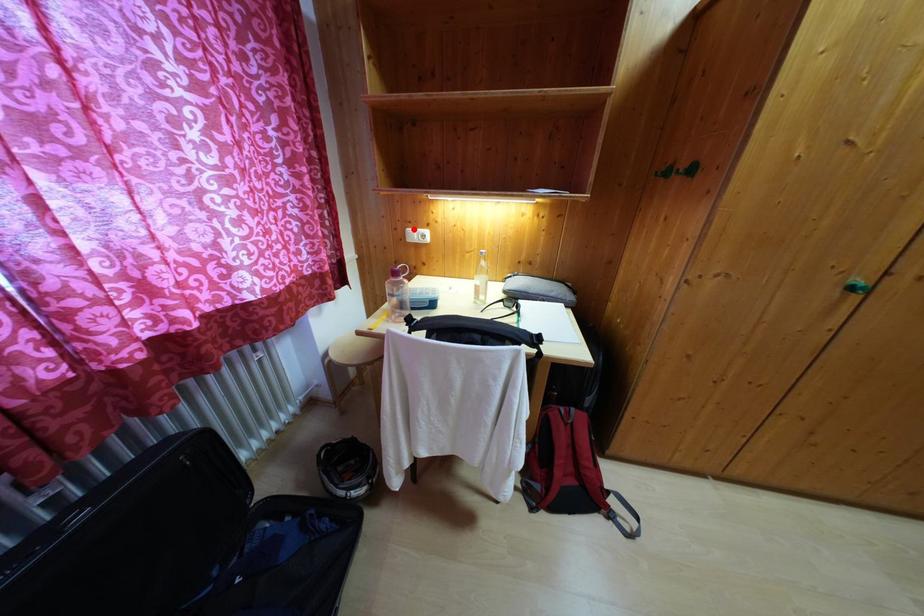
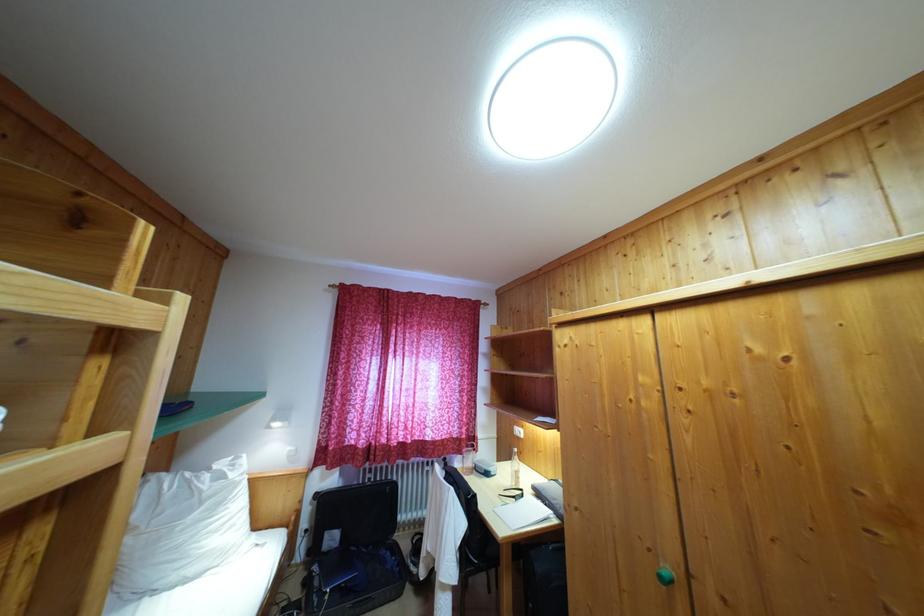
Question: I am providing you with two images of the same scene from different viewpoints. A red point is marked on the first image. At the location where the point appears in image 1, is it still visible in image 2?

Choices:
 (A) Yes
 (B) No

Answer: (B)